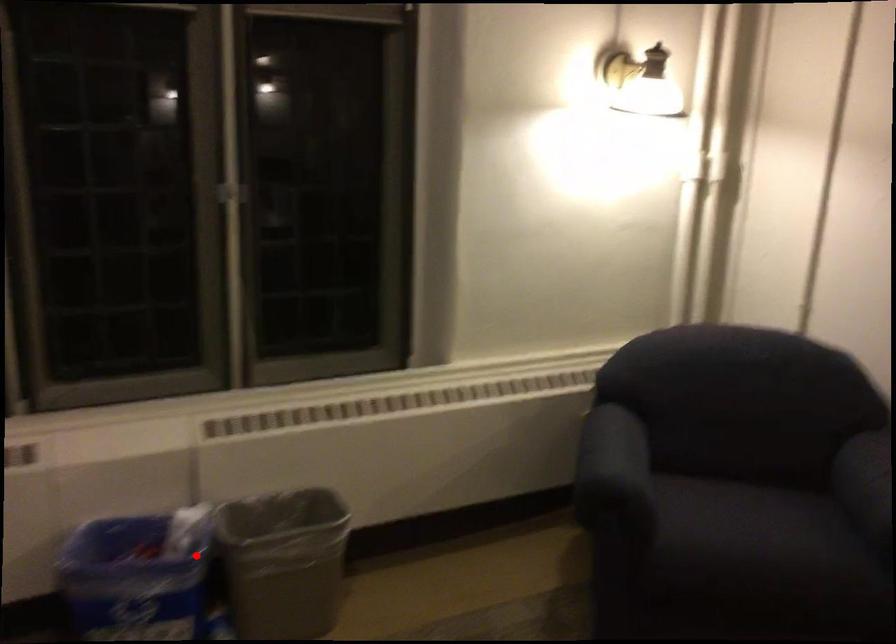
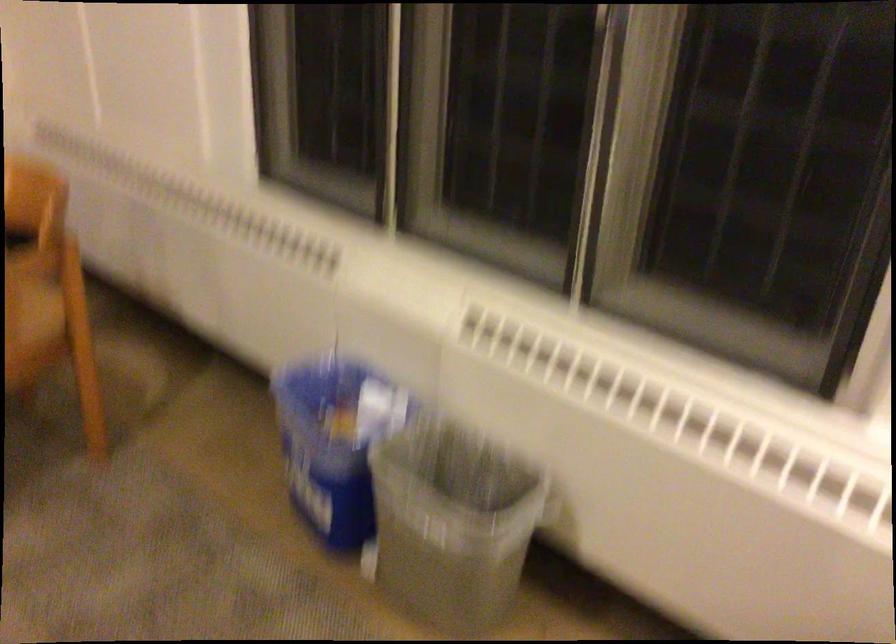
Where in the second image is the point corresponding to the highlighted location from the first image?

(334, 442)